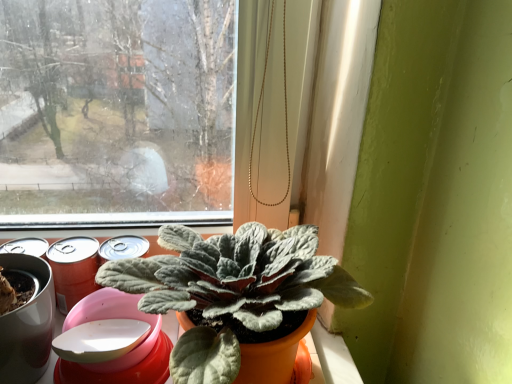
Locate an element on the screen. metallic red can at left is located at coordinates (73, 269).

This screenshot has width=512, height=384. What do you see at coordinates (73, 269) in the screenshot?
I see `metallic red can at left` at bounding box center [73, 269].

This screenshot has height=384, width=512. What do you see at coordinates (234, 296) in the screenshot?
I see `fuzzy green plant at center` at bounding box center [234, 296].

Locate an element on the screen. fuzzy green plant at center is located at coordinates (234, 296).

Locate an element on the screen. The height and width of the screenshot is (384, 512). metallic red can at left is located at coordinates (73, 269).

Is metallic red can at left at the right side of fuzzy green plant at center?

In fact, metallic red can at left is to the left of fuzzy green plant at center.

Is the depth of metallic red can at left greater than that of fuzzy green plant at center?

Yes.

Is point (75, 302) positioned before point (142, 301)?

No, it is not.

From the image's perspective, is metallic red can at left below fuzzy green plant at center?

Actually, metallic red can at left appears above fuzzy green plant at center in the image.

From a real-world perspective, between metallic red can at left and fuzzy green plant at center, who is vertically higher?

fuzzy green plant at center is physically above.

Looking at their sizes, would you say metallic red can at left is wider or thinner than fuzzy green plant at center?

Considering their sizes, metallic red can at left looks slimmer than fuzzy green plant at center.

Is metallic red can at left shorter than fuzzy green plant at center?

Indeed, metallic red can at left has a lesser height compared to fuzzy green plant at center.

Who is smaller, metallic red can at left or fuzzy green plant at center?

metallic red can at left is smaller.

Is metallic red can at left positioned beyond the bounds of fuzzy green plant at center?

Yes.

Is metallic red can at left far from fuzzy green plant at center?

metallic red can at left is actually quite close to fuzzy green plant at center.

Is metallic red can at left facing towards fuzzy green plant at center?

No.

You are a GUI agent. You are given a task and a screenshot of the screen. Output one action in this format:
    pyautogui.click(x=<x>, y=<y>)
    Task: Click on the houseplant on the right of metallic red can at left
    This screenshot has width=512, height=384.
    Given the screenshot: What is the action you would take?
    pyautogui.click(x=234, y=296)

Can you confirm if fuzzy green plant at center is positioned to the right of metallic red can at left?

Yes, fuzzy green plant at center is to the right of metallic red can at left.

Is fuzzy green plant at center in front of or behind metallic red can at left in the image?

fuzzy green plant at center is in front of metallic red can at left.

Looking at this image, which point is more distant from viewer, (184,245) or (87,265)?

The point (87,265) is farther.

Consider the image. From the image's perspective, is fuzzy green plant at center located above metallic red can at left?

No, from the image's perspective, fuzzy green plant at center is not above metallic red can at left.

From a real-world perspective, does fuzzy green plant at center sit lower than metallic red can at left?

Incorrect, from a real-world perspective, fuzzy green plant at center is higher than metallic red can at left.

Which object is wider, fuzzy green plant at center or metallic red can at left?

fuzzy green plant at center.

Looking at this image, between fuzzy green plant at center and metallic red can at left, which one has more height?

fuzzy green plant at center is taller.

Can you confirm if fuzzy green plant at center is smaller than metallic red can at left?

Incorrect, fuzzy green plant at center is not smaller in size than metallic red can at left.

Is metallic red can at left surrounded by fuzzy green plant at center?

No, fuzzy green plant at center does not contain metallic red can at left.

Would you consider fuzzy green plant at center to be distant from metallic red can at left?

No, there isn't a large distance between fuzzy green plant at center and metallic red can at left.

Is fuzzy green plant at center facing away from metallic red can at left?

fuzzy green plant at center does not have its back to metallic red can at left.

How much distance is there between fuzzy green plant at center and metallic red can at left?

A distance of 9.78 inches exists between fuzzy green plant at center and metallic red can at left.

There is a metallic red can at left. Identify the location of houseplant above it (from a real-world perspective). This screenshot has height=384, width=512. (234, 296).

In the image, there is a metallic red can at left. Identify the location of houseplant below it (from the image's perspective). This screenshot has width=512, height=384. (234, 296).

The image size is (512, 384). In order to click on houseplant above the metallic red can at left (from a real-world perspective) in this screenshot , I will do `click(234, 296)`.